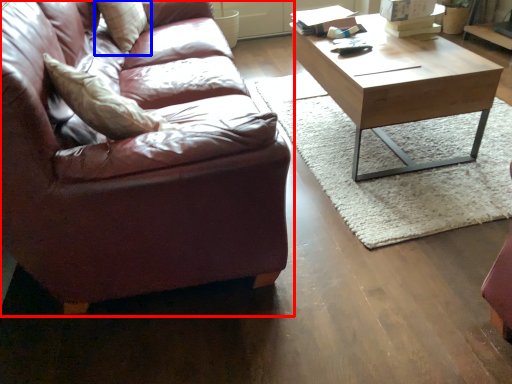
Question: Which point is further to the camera, studio couch (highlighted by a red box) or pillow (highlighted by a blue box)?

Choices:
 (A) studio couch
 (B) pillow

Answer: (B)